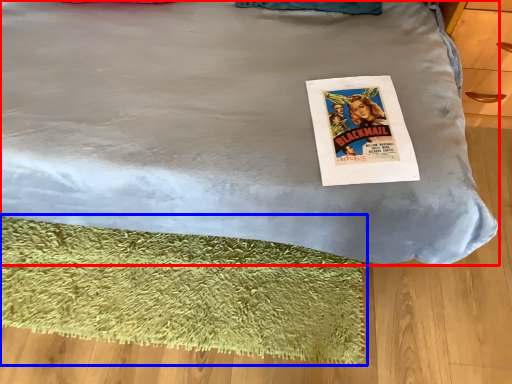
Question: Which of the following is the closest to the observer, bed (highlighted by a red box) or mat (highlighted by a blue box)?

Choices:
 (A) bed
 (B) mat

Answer: (A)